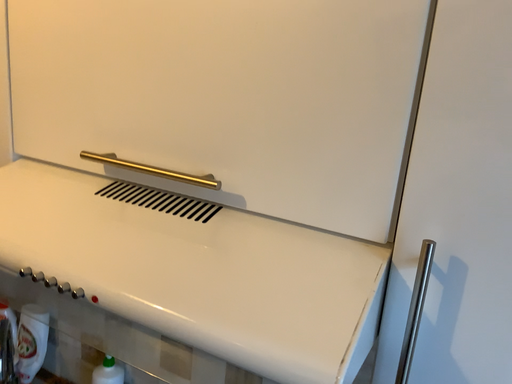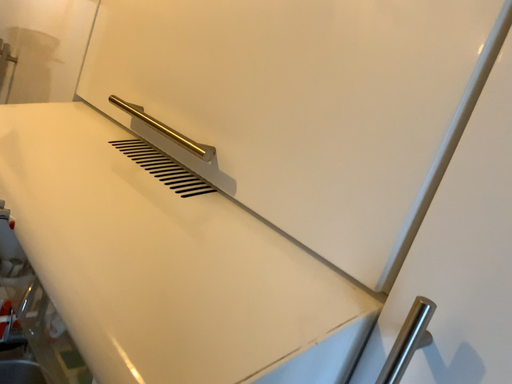
Question: How did the camera likely rotate when shooting the video?

Choices:
 (A) rotated upward
 (B) rotated downward

Answer: (A)